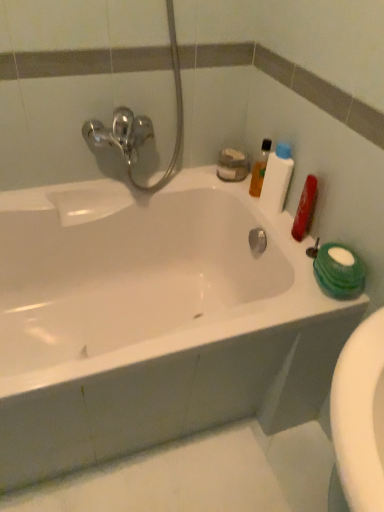
At what (x,y) coordinates should I click in order to perform the action: click on translucent plastic bottle at upper right. Please return your answer as a coordinate pair (x, y). This screenshot has width=384, height=512. Looking at the image, I should click on (x=260, y=169).

I want to click on translucent plastic bottle at upper right, so click(277, 178).

The height and width of the screenshot is (512, 384). I want to click on translucent plastic bottle at upper right, so click(x=260, y=169).

Between white glossy bathtub at upper center and translucent plastic bottle at upper right, which one has larger width?

white glossy bathtub at upper center is wider.

Is white glossy bathtub at upper center touching translucent plastic bottle at upper right?

No.

Is point (173, 398) behind point (284, 194)?

No, it is not.

Is white glossy bathtub at upper center at the left side of translucent plastic bottle at upper right?

Correct, you'll find white glossy bathtub at upper center to the left of translucent plastic bottle at upper right.

Could translucent plastic bottle at upper right be considered to be inside white glossy bathtub at upper center?

No, translucent plastic bottle at upper right is not inside white glossy bathtub at upper center.

Which object is closer to the camera, white glossy bathtub at upper center or translucent plastic bottle at upper right?

white glossy bathtub at upper center is closer to the camera.

Who is taller, white glossy bathtub at upper center or translucent plastic bottle at upper right?

white glossy bathtub at upper center is taller.

Which of these two, white glossy bathtub at upper center or translucent plastic bottle at upper right, is bigger?

white glossy bathtub at upper center is bigger.

Is translucent plastic bottle at upper right directly adjacent to white glossy bathtub at upper center?

No, translucent plastic bottle at upper right is not next to white glossy bathtub at upper center.

Is translucent plastic bottle at upper right oriented towards white glossy bathtub at upper center?

No, translucent plastic bottle at upper right is not aimed at white glossy bathtub at upper center.

Which of these two, translucent plastic bottle at upper right or white glossy bathtub at upper center, is smaller?

Smaller between the two is translucent plastic bottle at upper right.

Considering the sizes of translucent plastic bottle at upper right and white glossy bathtub at upper center in the image, is translucent plastic bottle at upper right taller or shorter than white glossy bathtub at upper center?

Considering their sizes, translucent plastic bottle at upper right has less height than white glossy bathtub at upper center.

Is translucent plastic bottle at upper right directly adjacent to white glossy bathtub at upper center?

translucent plastic bottle at upper right and white glossy bathtub at upper center are not in contact.

Is white glossy bathtub at upper center located within translucent plastic bottle at upper right?

That's incorrect, white glossy bathtub at upper center is not inside translucent plastic bottle at upper right.

Which is in front, point (253, 177) or point (37, 445)?

The point (37, 445) is closer to the camera.

Between translucent plastic bottle at upper right and white glossy bathtub at upper center, which one has larger width?

white glossy bathtub at upper center is wider.

Who is shorter, translucent plastic bottle at upper right or translucent plastic bottle at upper right?

translucent plastic bottle at upper right.

Is translucent plastic bottle at upper right not close to translucent plastic bottle at upper right?

translucent plastic bottle at upper right is near translucent plastic bottle at upper right, not far away.

From a real-world perspective, which is physically below, translucent plastic bottle at upper right or translucent plastic bottle at upper right?

translucent plastic bottle at upper right.

Could you tell me if translucent plastic bottle at upper right is facing translucent plastic bottle at upper right?

No, translucent plastic bottle at upper right is not facing towards translucent plastic bottle at upper right.

What's the angular difference between translucent plastic bottle at upper right and translucent plastic bottle at upper right's facing directions?

The angular difference between translucent plastic bottle at upper right and translucent plastic bottle at upper right is 0.000193 degrees.

Looking at the image, does translucent plastic bottle at upper right seem bigger or smaller compared to translucent plastic bottle at upper right?

Clearly, translucent plastic bottle at upper right is larger in size than translucent plastic bottle at upper right.

Is translucent plastic bottle at upper right situated inside translucent plastic bottle at upper right or outside?

translucent plastic bottle at upper right is located beyond the bounds of translucent plastic bottle at upper right.

In terms of width, does translucent plastic bottle at upper right look wider or thinner when compared to translucent plastic bottle at upper right?

translucent plastic bottle at upper right is wider than translucent plastic bottle at upper right.

You are a GUI agent. You are given a task and a screenshot of the screen. Output one action in this format:
    pyautogui.click(x=<x>, y=<y>)
    Task: Click on the bathtub that is below the translucent plastic bottle at upper right (from the image's perspective)
    
    Given the screenshot: What is the action you would take?
    pyautogui.click(x=152, y=321)

The height and width of the screenshot is (512, 384). In order to click on cleaning product above the white glossy bathtub at upper center (from a real-world perspective) in this screenshot , I will do coord(260,169).

Looking at the image, which one is located further to translucent plastic bottle at upper right, white glossy bathtub at upper center or translucent plastic bottle at upper right?

white glossy bathtub at upper center is positioned further to the anchor translucent plastic bottle at upper right.

Based on their spatial positions, is translucent plastic bottle at upper right or translucent plastic bottle at upper right further from white glossy bathtub at upper center?

Based on the image, translucent plastic bottle at upper right appears to be further to white glossy bathtub at upper center.

Estimate the real-world distances between objects in this image. Which object is closer to translucent plastic bottle at upper right, translucent plastic bottle at upper right or white glossy bathtub at upper center?

Based on the image, translucent plastic bottle at upper right appears to be nearer to translucent plastic bottle at upper right.

When comparing their distances from translucent plastic bottle at upper right, does translucent plastic bottle at upper right or white glossy bathtub at upper center seem closer?

The object closer to translucent plastic bottle at upper right is translucent plastic bottle at upper right.

Considering their positions, is translucent plastic bottle at upper right positioned closer to white glossy bathtub at upper center than translucent plastic bottle at upper right?

translucent plastic bottle at upper right is closer to white glossy bathtub at upper center.

Which object lies further to the anchor point translucent plastic bottle at upper right, white glossy bathtub at upper center or translucent plastic bottle at upper right?

white glossy bathtub at upper center lies further to translucent plastic bottle at upper right than the other object.

Identify the location of toiletry between white glossy bathtub at upper center and translucent plastic bottle at upper right from front to back. (277, 178).